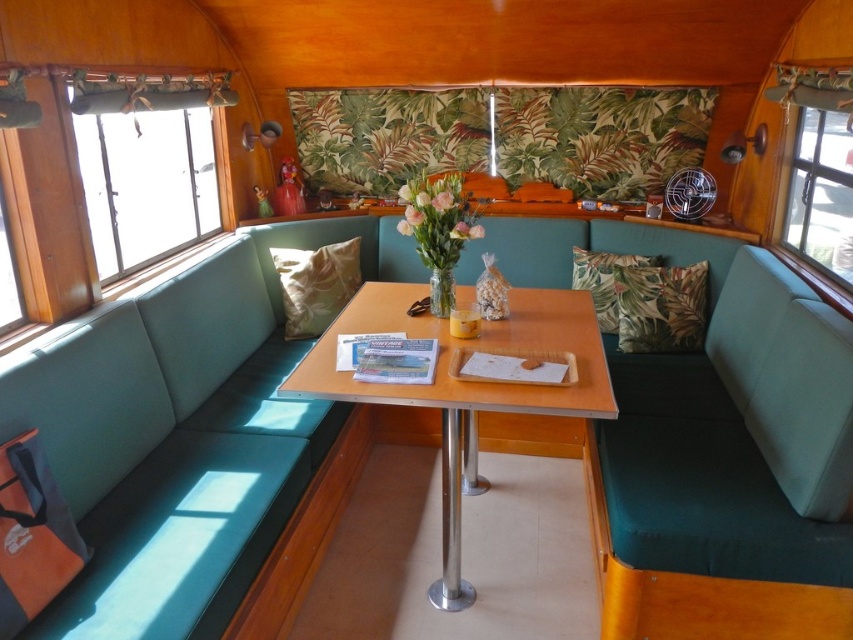
You are sitting in the retro diner booth and want to place your phone on the table. The table has a green leafy fabric pillow at center. Where exactly should you place your phone to ensure it doesn not get covered by the pillow?

The green leafy fabric pillow at center is located at point (660,307), so placing the phone away from that coordinate would keep it uncovered.

You are sitting in the retro diner booth and want to place your phone on the nearest object. Which object should you choose between the green leafy fabric pillow at center and the teal cushion behind you?

The green leafy fabric pillow at center is located at point (x=660, y=307), which is closer to you than the teal cushion behind you, so you should place your phone on the green leafy fabric pillow at center.

You are sitting in the retro diner booth and want to place a small book on the table between the green leafy fabric pillow at center and the floral fabric pillow at center. Which pillow should you place the book closer to if you want it to be higher?

The floral fabric pillow at center is taller than the green leafy fabric pillow at center, so placing the book closer to the floral fabric pillow at center will result in a higher placement.